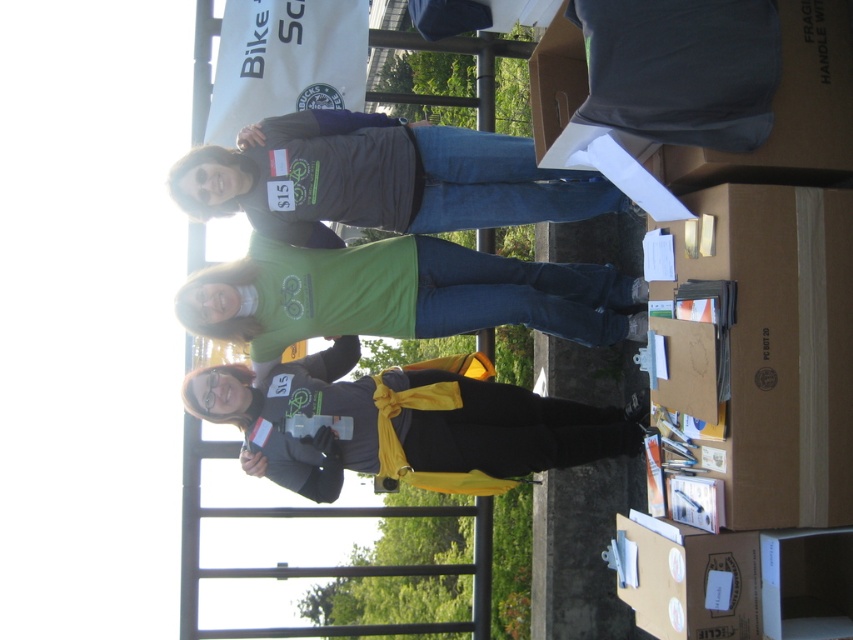
Question: Is brown cardboard box at lower right positioned at the back of matte gray shirt at center?

Choices:
 (A) no
 (B) yes

Answer: (A)

Question: Which is farther from the matte black jacket at center?

Choices:
 (A) cardboard box at lower right
 (B) matte gray shirt at center

Answer: (A)

Question: Which object is the farthest from the matte gray shirt at center?

Choices:
 (A) brown cardboard box at lower right
 (B) green matte shirt at center
 (C) matte black jacket at center
 (D) cardboard box at lower right

Answer: (D)

Question: Is matte gray shirt at center wider than green matte shirt at center?

Choices:
 (A) no
 (B) yes

Answer: (A)

Question: Where is matte black jacket at center located in relation to cardboard box at lower right in the image?

Choices:
 (A) left
 (B) right

Answer: (A)

Question: Based on their relative distances, which object is farther from the cardboard box at lower right?

Choices:
 (A) brown cardboard box at lower right
 (B) matte gray shirt at center
 (C) green matte shirt at center
 (D) matte black jacket at center

Answer: (B)